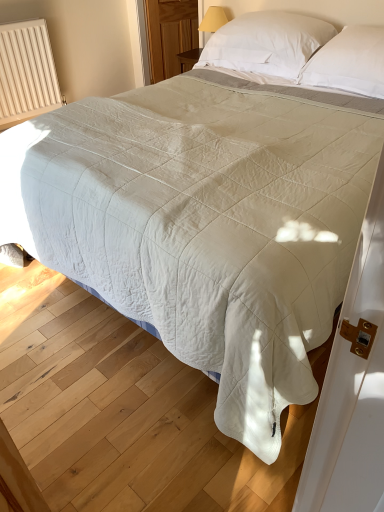
Question: Is transparent wooden door at upper center to the right of white soft pillow at upper center, acting as the first pillow starting from the left, from the viewer's perspective?

Choices:
 (A) no
 (B) yes

Answer: (A)

Question: Is transparent wooden door at upper center surrounding white soft pillow at upper center, acting as the first pillow starting from the left?

Choices:
 (A) no
 (B) yes

Answer: (A)

Question: Does transparent wooden door at upper center lie behind white soft pillow at upper center, arranged as the 2th pillow when viewed from the right?

Choices:
 (A) yes
 (B) no

Answer: (A)

Question: From a real-world perspective, is transparent wooden door at upper center on white soft pillow at upper center, arranged as the 2th pillow when viewed from the right?

Choices:
 (A) no
 (B) yes

Answer: (A)

Question: Is transparent wooden door at upper center wider than white soft pillow at upper center, arranged as the 2th pillow when viewed from the right?

Choices:
 (A) yes
 (B) no

Answer: (B)

Question: Would you say transparent wooden door at upper center is outside white soft pillow at upper center, acting as the first pillow starting from the left?

Choices:
 (A) no
 (B) yes

Answer: (B)

Question: Can you confirm if white soft pillow at upper center, arranged as the 2th pillow when viewed from the right, is taller than beige ribbed radiator at left?

Choices:
 (A) yes
 (B) no

Answer: (B)

Question: Does white soft pillow at upper center, acting as the first pillow starting from the left, have a lesser width compared to beige ribbed radiator at left?

Choices:
 (A) yes
 (B) no

Answer: (B)

Question: Could you tell me if white soft pillow at upper center, arranged as the 2th pillow when viewed from the right, is turned towards beige ribbed radiator at left?

Choices:
 (A) no
 (B) yes

Answer: (A)

Question: From the image's perspective, is white soft pillow at upper center, acting as the first pillow starting from the left, on top of beige ribbed radiator at left?

Choices:
 (A) yes
 (B) no

Answer: (B)

Question: Is white soft pillow at upper center, acting as the first pillow starting from the left, located outside beige ribbed radiator at left?

Choices:
 (A) yes
 (B) no

Answer: (A)

Question: Is transparent wooden door at upper center thinner than beige ribbed radiator at left?

Choices:
 (A) yes
 (B) no

Answer: (A)